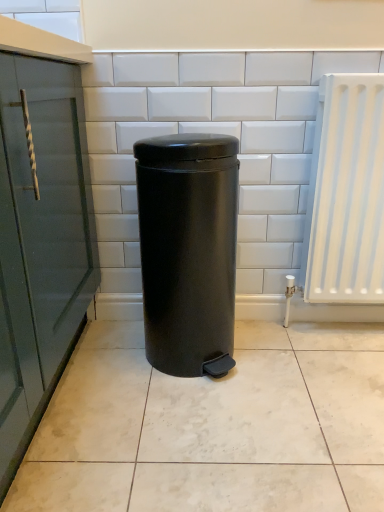
I want to click on blank area to the left of matte black trash can at center, so click(x=102, y=370).